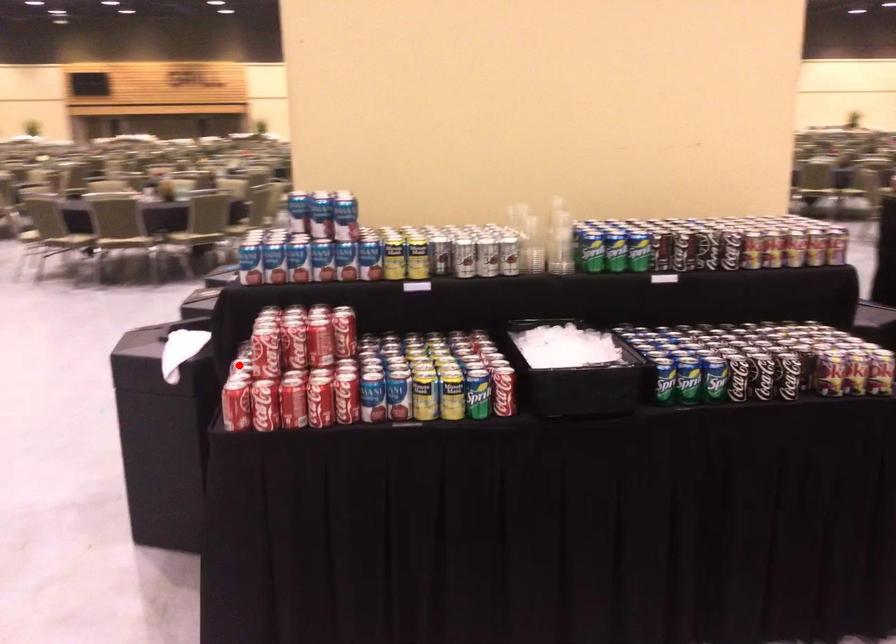
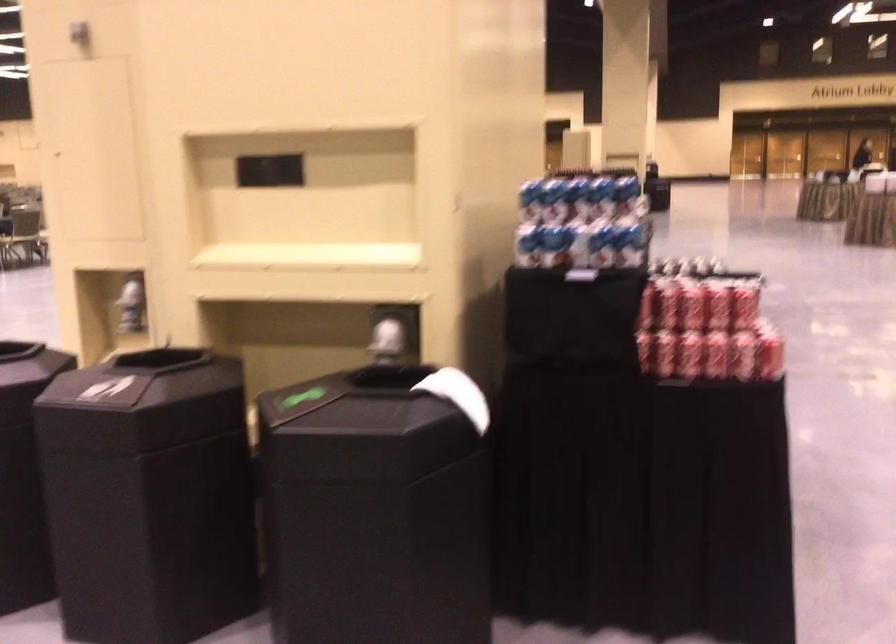
Find the pixel in the second image that matches the highlighted location in the first image.

(664, 353)